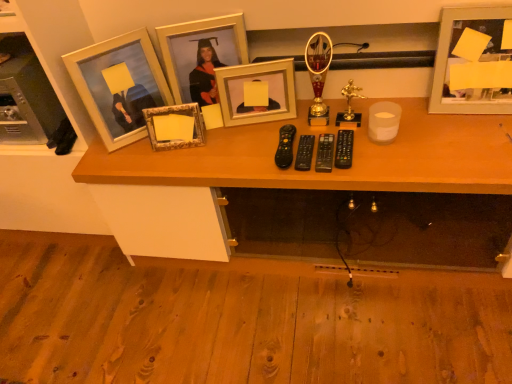
Locate an element on the screen. free space in front of gold textured photo frame at center, which is the fourth picture frame in right-to-left order is located at coordinates (185, 161).